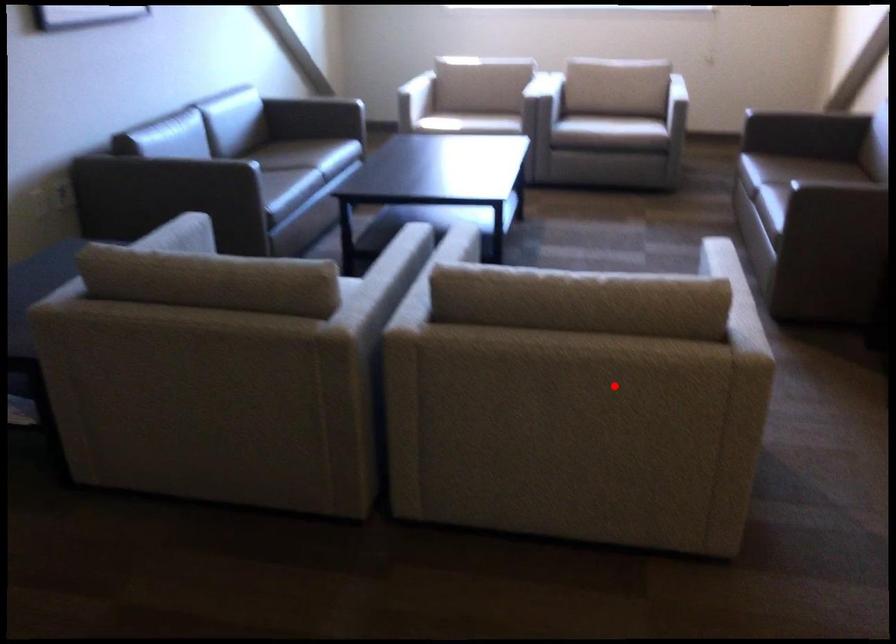
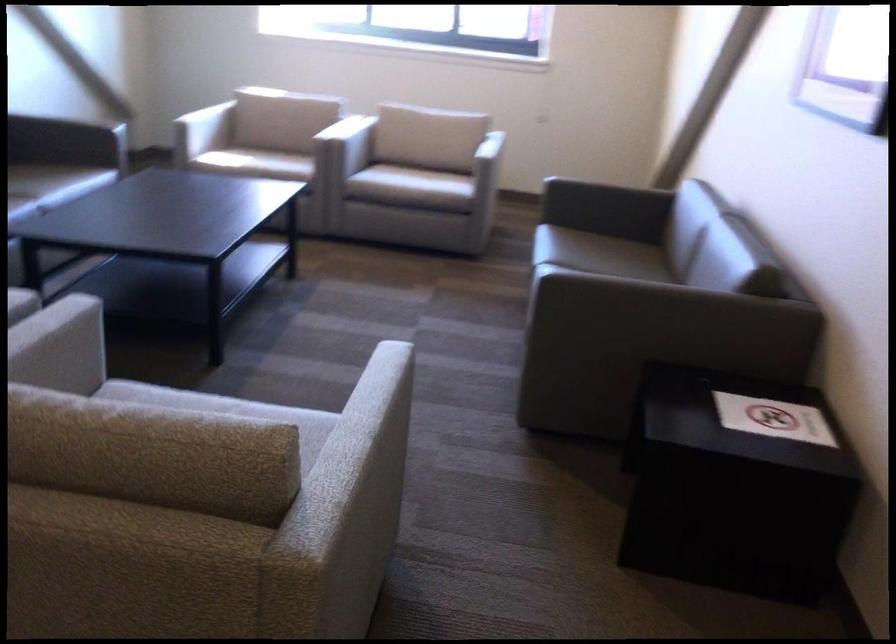
Question: I am providing you with two images of the same scene from different viewpoints. Given a red point in image1, look at the same physical point in image2. Is it:

Choices:
 (A) Closer to the viewpoint
 (B) Farther from the viewpoint

Answer: (A)